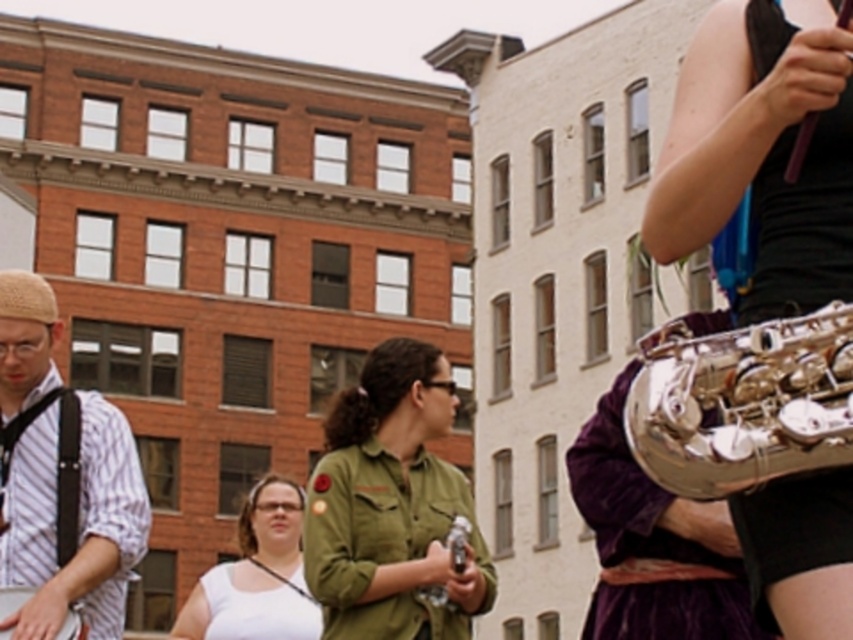
Question: Based on their relative distances, which object is farther from the shiny silver saxophone at right?

Choices:
 (A) white matte dress at center
 (B) striped cotton shirt at left
 (C) clear plastic bottle at center
 (D) white matte tank top at center

Answer: (D)

Question: Which of the following is the farthest from the observer?

Choices:
 (A) (387, 614)
 (B) (201, 596)

Answer: (B)

Question: Is green matte shirt at center bigger than silver polished trumpet at right?

Choices:
 (A) yes
 (B) no

Answer: (B)

Question: Can you confirm if green matte shirt at center is positioned to the right of white matte dress at center?

Choices:
 (A) yes
 (B) no

Answer: (A)

Question: Does white matte tank top at center appear on the left side of white matte dress at center?

Choices:
 (A) yes
 (B) no

Answer: (B)

Question: Which point is farther to the camera?

Choices:
 (A) (399, 352)
 (B) (316, 624)
 (C) (102, 625)

Answer: (B)